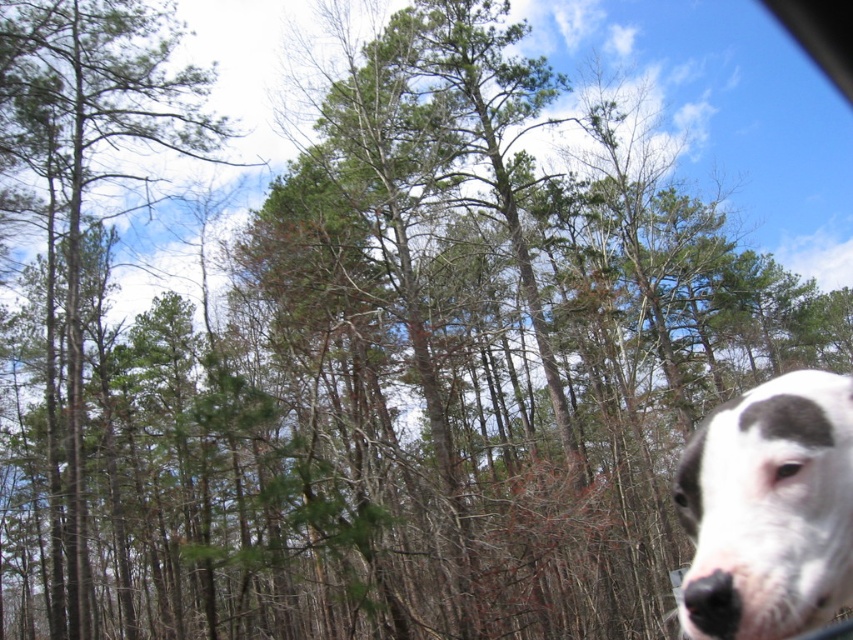
You are standing at the center of the forest looking towards the dense trees. There is a white fur dog at lower right in the scene. Based on its position, where would you expect the dog to be relative to your field of view?

The white fur dog at lower right is located at the lower right corner of the field of view since its 2D coordinates are at point (769, 509).

You are standing at point (155, 28) and want to walk to point (796, 506). Based on the scene description, which direction should you move to reach your destination?

To reach point (796, 506) from point (155, 28), you should move towards the upper right direction since point (796, 506) is located in the upper right relative to point (155, 28).